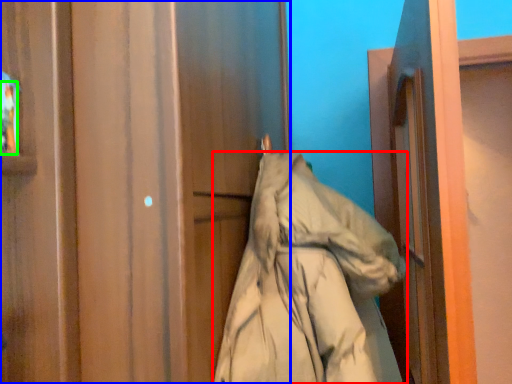
Question: Estimate the real-world distances between objects in this image. Which object is farther from coat (highlighted by a red box), door (highlighted by a blue box) or person (highlighted by a green box)?

Choices:
 (A) door
 (B) person

Answer: (B)